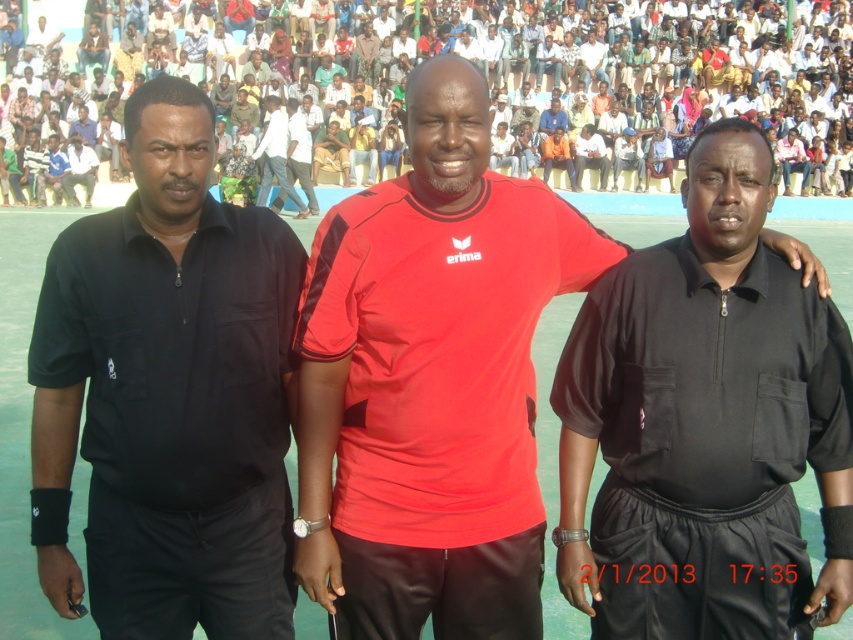
Question: Among these points, which one is nearest to the camera?

Choices:
 (A) (294, 234)
 (B) (640, 625)

Answer: (B)

Question: Which of the following is the farthest from the observer?

Choices:
 (A) (460, 570)
 (B) (575, 420)
 (C) (265, 192)

Answer: (C)

Question: Is matte polyester polo shirt at center below light blue jeans at center?

Choices:
 (A) no
 (B) yes

Answer: (B)

Question: Can you confirm if black matte uniform at center is positioned to the left of matte polyester polo shirt at center?

Choices:
 (A) yes
 (B) no

Answer: (B)

Question: Which point is farther from the camera taking this photo?

Choices:
 (A) (492, 308)
 (B) (836, 324)
 (C) (175, 456)

Answer: (B)

Question: Considering the relative positions of black matte shirt at left and red matte jersey at center in the image provided, where is black matte shirt at left located with respect to red matte jersey at center?

Choices:
 (A) above
 (B) below

Answer: (B)